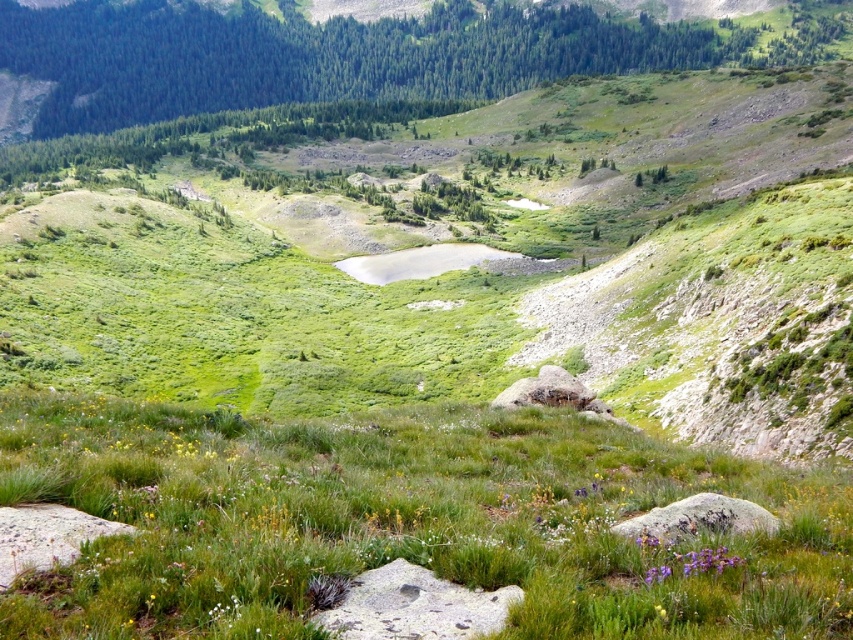
Question: Which object is farther from the camera taking this photo?

Choices:
 (A) gray rough rock at lower left
 (B) purple matte flower at lower right
 (C) gray rough rock at lower right
 (D) green grassy at center

Answer: (C)

Question: Is the position of green grassy at center more distant than that of gray/rough rock at center?

Choices:
 (A) no
 (B) yes

Answer: (A)

Question: Does green grassy at center have a smaller size compared to gray rough rock at lower left?

Choices:
 (A) yes
 (B) no

Answer: (B)

Question: Which object appears farthest from the camera in this image?

Choices:
 (A) green grassy at center
 (B) gray rough rock at lower left
 (C) gray rough rock at lower right

Answer: (C)

Question: Which point is farther to the camera?

Choices:
 (A) (45, 545)
 (B) (660, 508)

Answer: (B)

Question: Is gray rough rock at lower left to the left of purple matte flower at lower right from the viewer's perspective?

Choices:
 (A) yes
 (B) no

Answer: (A)